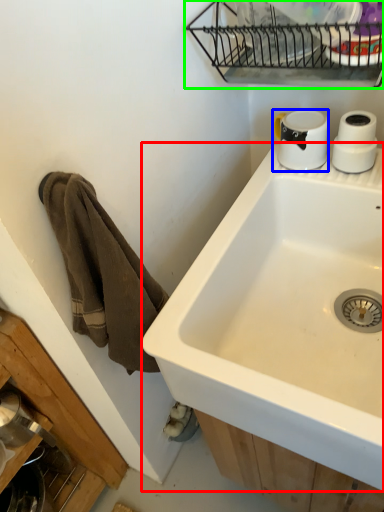
Question: Estimate the real-world distances between objects in this image. Which object is farther from sink (highlighted by a red box), coffee cup (highlighted by a blue box) or appliance (highlighted by a green box)?

Choices:
 (A) coffee cup
 (B) appliance

Answer: (B)